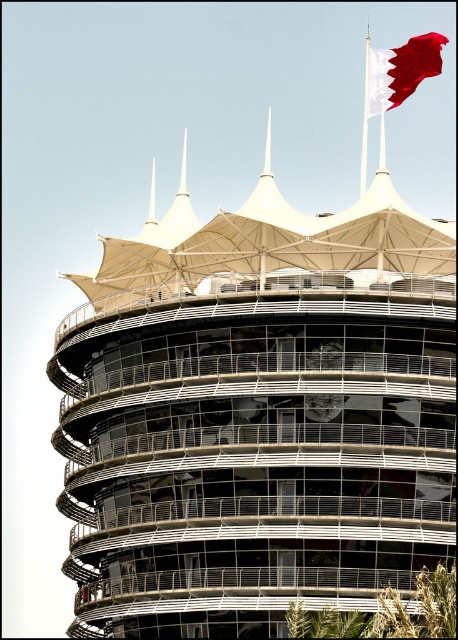
In the scene shown: You are standing in front of the modern architectural structure. You want to take a photo of the white glass tower at center and the white fabric flag at upper right. Which object should you focus on first to ensure both are in the frame?

You should focus on the white glass tower at center first because it is closer to the viewer than the white fabric flag at upper right, so by focusing on the closer object, both will be in focus.

You are standing on the observation deck of the white glass tower at center and want to take a photo of the white fabric flag at upper right. Since the tower is much taller than the flag, will you need to look up or down to frame the flag in your camera?

The white glass tower at center is much taller than the white fabric flag at upper right. Therefore, to take a photo of the white fabric flag at upper right from the tower, you would need to look down since the flag is positioned lower than the tower.